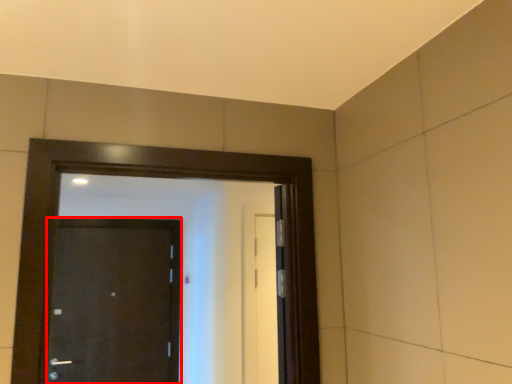
Question: Observing the image, what is the correct spatial positioning of door (annotated by the red box) in reference to door?

Choices:
 (A) left
 (B) right

Answer: (A)